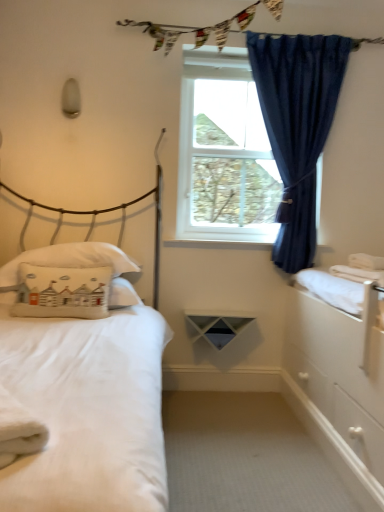
Identify the location of white cotton pillow at left, acting as the first pillow starting from the front. (62, 292).

What do you see at coordinates (62, 292) in the screenshot? I see `white cotton pillow at left, acting as the first pillow starting from the front` at bounding box center [62, 292].

What do you see at coordinates (203, 27) in the screenshot? This screenshot has height=512, width=384. I see `textured fabric clothesline at upper center` at bounding box center [203, 27].

This screenshot has width=384, height=512. Describe the element at coordinates (82, 395) in the screenshot. I see `white matte bed at left` at that location.

What is the approximate height of white matte bed at left?

It is 5.15 feet.

This screenshot has height=512, width=384. What do you see at coordinates (338, 378) in the screenshot?
I see `white glossy dresser at right` at bounding box center [338, 378].

Based on the photo, what is the approximate width of white plastic window at center?

It is 2.73 inches.

Image resolution: width=384 pixels, height=512 pixels. Find the location of `white plastic window at center`. white plastic window at center is located at coordinates (224, 152).

The width and height of the screenshot is (384, 512). In order to click on white cotton pillow at left, marked as the 2th pillow in a front-to-back arrangement in this screenshot , I will do click(x=80, y=266).

Is white matte bed at left inside the boundaries of white cotton pillow at left, marked as the 2th pillow in a front-to-back arrangement, or outside?

white matte bed at left is spatially situated outside white cotton pillow at left, marked as the 2th pillow in a front-to-back arrangement.

Which of these two, white matte bed at left or white cotton pillow at left, marked as the 2th pillow in a front-to-back arrangement, is bigger?

With larger size is white matte bed at left.

Locate an element on the screen. This screenshot has height=512, width=384. bed below the white cotton pillow at left, which is counted as the first pillow, starting from the back (from the image's perspective) is located at coordinates (82, 395).

Between white matte bed at left and white cotton pillow at left, which is counted as the first pillow, starting from the back, which one is positioned in front?

Positioned in front is white matte bed at left.

Could you tell me if white matte bed at left is turned towards white cotton pillow at left, placed as the second pillow when sorted from back to front?

No, white matte bed at left is not oriented towards white cotton pillow at left, placed as the second pillow when sorted from back to front.

From a real-world perspective, between white matte bed at left and white cotton pillow at left, acting as the first pillow starting from the front, who is vertically lower?

white cotton pillow at left, acting as the first pillow starting from the front, is physically lower.

Who is more distant, white matte bed at left or white cotton pillow at left, placed as the second pillow when sorted from back to front?

white cotton pillow at left, placed as the second pillow when sorted from back to front, is further away from the camera.

Looking at the image, does textured fabric clothesline at upper center seem bigger or smaller compared to white glossy dresser at right?

textured fabric clothesline at upper center is smaller than white glossy dresser at right.

Considering the relative positions of textured fabric clothesline at upper center and white glossy dresser at right in the image provided, is textured fabric clothesline at upper center to the left or to the right of white glossy dresser at right?

textured fabric clothesline at upper center is positioned on white glossy dresser at right's left side.

Based on the photo, does textured fabric clothesline at upper center have a greater width compared to white glossy dresser at right?

Incorrect, the width of textured fabric clothesline at upper center does not surpass that of white glossy dresser at right.

From a real-world perspective, relative to white glossy dresser at right, is textured fabric clothesline at upper center vertically above or below?

In terms of real-world spatial position, textured fabric clothesline at upper center is above white glossy dresser at right.

Based on the photo, does white cotton pillow at left, marked as the 2th pillow in a front-to-back arrangement, have a smaller size compared to white glossy dresser at right?

Yes.

Are white cotton pillow at left, marked as the 2th pillow in a front-to-back arrangement, and white glossy dresser at right located far from each other?

That's right, there is a large distance between white cotton pillow at left, marked as the 2th pillow in a front-to-back arrangement, and white glossy dresser at right.

From a real-world perspective, is white cotton pillow at left, marked as the 2th pillow in a front-to-back arrangement, positioned above or below white glossy dresser at right?

From a real-world perspective, white cotton pillow at left, marked as the 2th pillow in a front-to-back arrangement, is physically above white glossy dresser at right.

From a real-world perspective, is blue velvet curtain at upper right beneath white glossy dresser at right?

Incorrect, from a real-world perspective, blue velvet curtain at upper right is higher than white glossy dresser at right.

Considering the sizes of objects blue velvet curtain at upper right and white glossy dresser at right in the image provided, who is thinner, blue velvet curtain at upper right or white glossy dresser at right?

blue velvet curtain at upper right.

Does point (299, 50) lie in front of point (363, 290)?

No, (299, 50) is further to viewer.

Is blue velvet curtain at upper right spatially inside white glossy dresser at right, or outside of it?

blue velvet curtain at upper right is not inside white glossy dresser at right, it's outside.

Is white glossy dresser at right far from white matte bed at left?

white glossy dresser at right is actually quite close to white matte bed at left.

From the image's perspective, is white glossy dresser at right beneath white matte bed at left?

Yes, from the image's perspective, white glossy dresser at right is below white matte bed at left.

Based on the photo, can you tell me how much white glossy dresser at right and white matte bed at left differ in facing direction?

They differ by 89.5 degrees in their facing directions.

Based on the photo, considering the relative sizes of textured fabric clothesline at upper center and white matte bed at left in the image provided, is textured fabric clothesline at upper center taller than white matte bed at left?

No.

Is textured fabric clothesline at upper center in contact with white matte bed at left?

They are not placed beside each other.

Between textured fabric clothesline at upper center and white matte bed at left, which one has larger width?

white matte bed at left.

Is textured fabric clothesline at upper center in front of or behind white matte bed at left in the image?

Clearly, textured fabric clothesline at upper center is behind white matte bed at left.

Identify the location of bed that is on the right side of white cotton pillow at left, marked as the 2th pillow in a front-to-back arrangement. The width and height of the screenshot is (384, 512). (82, 395).

From the white matte bed at left, count 1st pillows backward and point to it. Please provide its 2D coordinates.

[(62, 292)]

From the image, which object appears to be farther from textured fabric clothesline at upper center, white glossy dresser at right or white plastic window at center?

white glossy dresser at right is further to textured fabric clothesline at upper center.

Looking at the image, which one is located further to white glossy dresser at right, white plastic window at center or white matte bed at left?

white plastic window at center lies further to white glossy dresser at right than the other object.

Based on their spatial positions, is textured fabric clothesline at upper center or white cotton pillow at left, acting as the first pillow starting from the front, further from white glossy dresser at right?

textured fabric clothesline at upper center is positioned further to the anchor white glossy dresser at right.

From the image, which object appears to be nearer to white glossy dresser at right, white cotton pillow at left, marked as the 2th pillow in a front-to-back arrangement, or white plastic window at center?

white plastic window at center lies closer to white glossy dresser at right than the other object.

Based on their spatial positions, is blue velvet curtain at upper right or white plastic window at center further from white matte bed at left?

blue velvet curtain at upper right is further to white matte bed at left.

Based on their spatial positions, is white cotton pillow at left, acting as the first pillow starting from the front, or white glossy dresser at right closer to textured fabric clothesline at upper center?

white cotton pillow at left, acting as the first pillow starting from the front, lies closer to textured fabric clothesline at upper center than the other object.

Estimate the real-world distances between objects in this image. Which object is further from white plastic window at center, blue velvet curtain at upper right or white cotton pillow at left, placed as the second pillow when sorted from back to front?

Based on the image, white cotton pillow at left, placed as the second pillow when sorted from back to front, appears to be further to white plastic window at center.

Estimate the real-world distances between objects in this image. Which object is closer to textured fabric clothesline at upper center, white glossy dresser at right or white matte bed at left?

The object closer to textured fabric clothesline at upper center is white matte bed at left.

Identify the location of clothesline between white matte bed at left and white plastic window at center along the z-axis. (203, 27).

At what (x,y) coordinates should I click in order to perform the action: click on curtain that lies between textured fabric clothesline at upper center and white glossy dresser at right from top to bottom. Please return your answer as a coordinate pair (x, y). The image size is (384, 512). Looking at the image, I should click on [297, 127].

Where is `window screen between textured fabric clothesline at upper center and white cotton pillow at left, acting as the first pillow starting from the front, vertically`? This screenshot has height=512, width=384. window screen between textured fabric clothesline at upper center and white cotton pillow at left, acting as the first pillow starting from the front, vertically is located at coordinates (224, 152).

Locate an element on the screen. window screen between white cotton pillow at left, acting as the first pillow starting from the front, and blue velvet curtain at upper right is located at coordinates (224, 152).